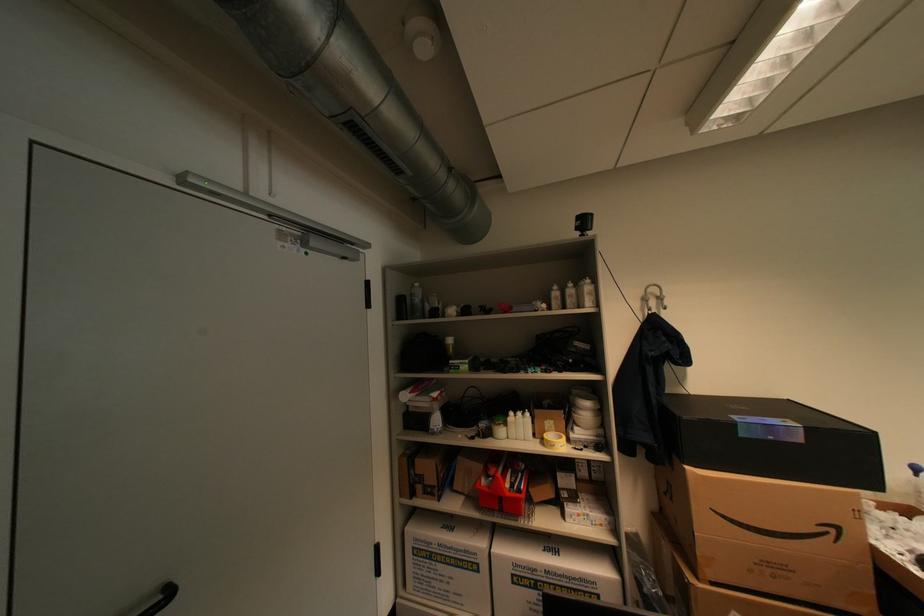
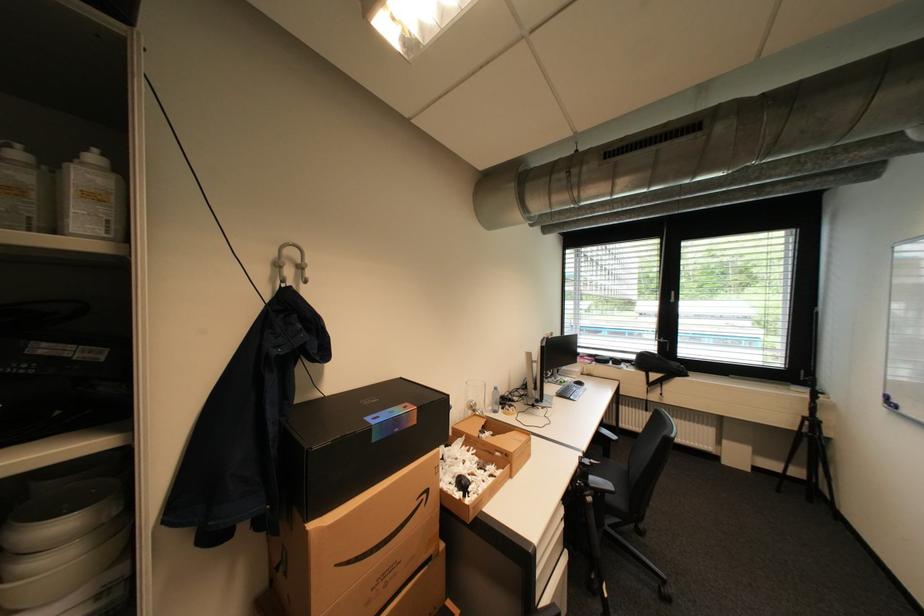
Find the pixel in the second image that matches pixel 661 302 in the first image.

(297, 272)